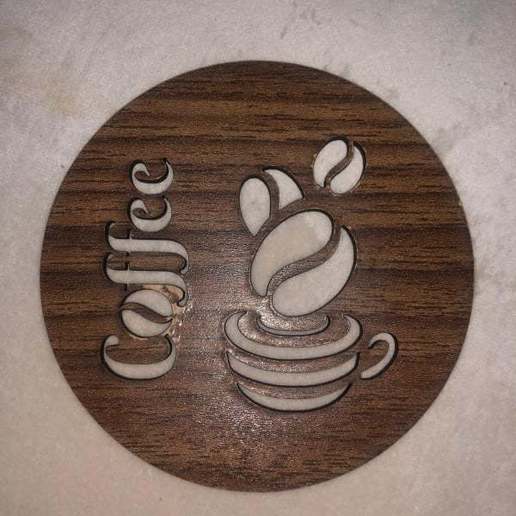
This screenshot has height=516, width=516. Identify the location of coffee mug handle. (382, 360).